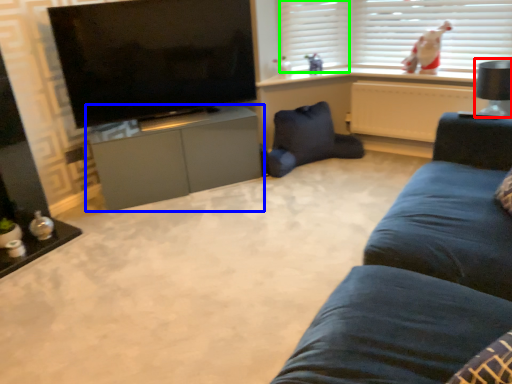
Question: Estimate the real-world distances between objects in this image. Which object is farther from lamp (highlighted by a red box), cabinetry (highlighted by a blue box) or shutter (highlighted by a green box)?

Choices:
 (A) cabinetry
 (B) shutter

Answer: (A)